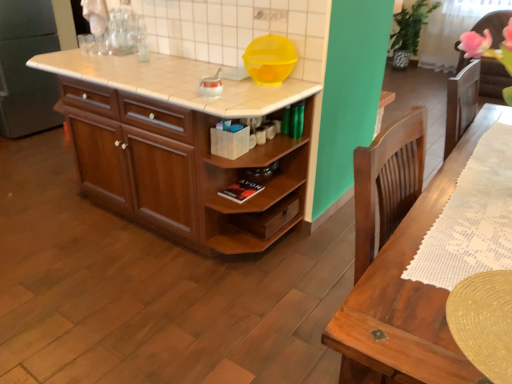
Question: From the image's perspective, is white glossy kettle at center, which is the first appliance in left-to-right order, beneath yellow plastic bowl at upper center, which ranks as the second appliance in left-to-right order?

Choices:
 (A) no
 (B) yes

Answer: (B)

Question: Is white glossy kettle at center, which ranks as the 2th appliance in right-to-left order, beside yellow plastic bowl at upper center, which ranks as the second appliance in left-to-right order?

Choices:
 (A) no
 (B) yes

Answer: (A)

Question: From a real-world perspective, is white glossy kettle at center, which is the first appliance in left-to-right order, over yellow plastic bowl at upper center, the 1th appliance viewed from the right?

Choices:
 (A) no
 (B) yes

Answer: (A)

Question: Is the depth of white glossy kettle at center, which is the first appliance in left-to-right order, greater than that of yellow plastic bowl at upper center, which ranks as the second appliance in left-to-right order?

Choices:
 (A) no
 (B) yes

Answer: (A)

Question: Is white glossy kettle at center, which is the first appliance in left-to-right order, shorter than yellow plastic bowl at upper center, the 1th appliance viewed from the right?

Choices:
 (A) no
 (B) yes

Answer: (B)

Question: In the image, is wooden cabinet at center on the left side or the right side of white glossy kettle at center, which is the first appliance in left-to-right order?

Choices:
 (A) right
 (B) left

Answer: (B)

Question: Based on their sizes in the image, would you say wooden cabinet at center is bigger or smaller than white glossy kettle at center, which is the first appliance in left-to-right order?

Choices:
 (A) big
 (B) small

Answer: (A)

Question: Is wooden cabinet at center in front of or behind white glossy kettle at center, which ranks as the 2th appliance in right-to-left order, in the image?

Choices:
 (A) behind
 (B) front

Answer: (B)

Question: Considering the positions of wooden cabinet at center and white glossy kettle at center, which is the first appliance in left-to-right order, in the image, is wooden cabinet at center wider or thinner than white glossy kettle at center, which is the first appliance in left-to-right order,?

Choices:
 (A) wide
 (B) thin

Answer: (A)

Question: From a real-world perspective, is wooden cabinet at center above or below yellow plastic bowl at upper center, the 1th appliance viewed from the right?

Choices:
 (A) above
 (B) below

Answer: (B)

Question: In terms of height, does wooden cabinet at center look taller or shorter compared to yellow plastic bowl at upper center, which ranks as the second appliance in left-to-right order?

Choices:
 (A) short
 (B) tall

Answer: (B)

Question: Considering the positions of point (140, 162) and point (284, 56), is point (140, 162) closer or farther from the camera than point (284, 56)?

Choices:
 (A) farther
 (B) closer

Answer: (A)

Question: Would you say wooden cabinet at center is to the left or to the right of yellow plastic bowl at upper center, the 1th appliance viewed from the right, in the picture?

Choices:
 (A) left
 (B) right

Answer: (A)

Question: From their relative heights in the image, would you say yellow plastic bowl at upper center, which ranks as the second appliance in left-to-right order, is taller or shorter than white tile countertop at center?

Choices:
 (A) tall
 (B) short

Answer: (A)

Question: Is yellow plastic bowl at upper center, the 1th appliance viewed from the right, situated inside white tile countertop at center or outside?

Choices:
 (A) outside
 (B) inside

Answer: (A)